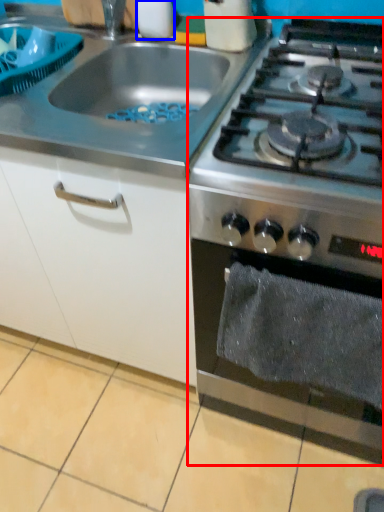
Question: Which of the following is the closest to the observer, gas stove (highlighted by a red box) or kitchen appliance (highlighted by a blue box)?

Choices:
 (A) gas stove
 (B) kitchen appliance

Answer: (A)